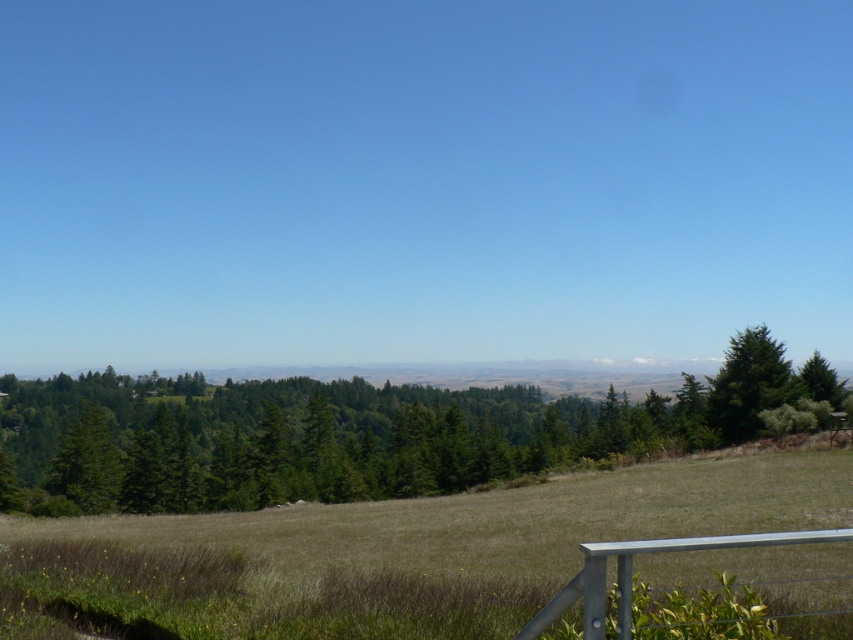
Is silver metallic rail at lower right above green textured tree at right?

Correct, silver metallic rail at lower right is located above green textured tree at right.

Which is below, silver metallic rail at lower right or green textured tree at right?

green textured tree at right is lower down.

Identify the location of silver metallic rail at lower right. pos(631,573).

Does green textured tree at center appear on the left side of green textured tree at right?

Correct, you'll find green textured tree at center to the left of green textured tree at right.

Measure the distance from green textured tree at center to green textured tree at right.

54.29 meters

Who is more distant from viewer, (x=508, y=474) or (x=714, y=381)?

Point (x=714, y=381)

Locate an element on the screen. Image resolution: width=853 pixels, height=640 pixels. green textured tree at center is located at coordinates (363, 433).

Is brown dry grass at center smaller than green textured tree at right?

No, brown dry grass at center is not smaller than green textured tree at right.

Between point (450, 636) and point (717, 428), which one is positioned in front?

Point (450, 636) is in front.

Image resolution: width=853 pixels, height=640 pixels. I want to click on brown dry grass at center, so click(392, 552).